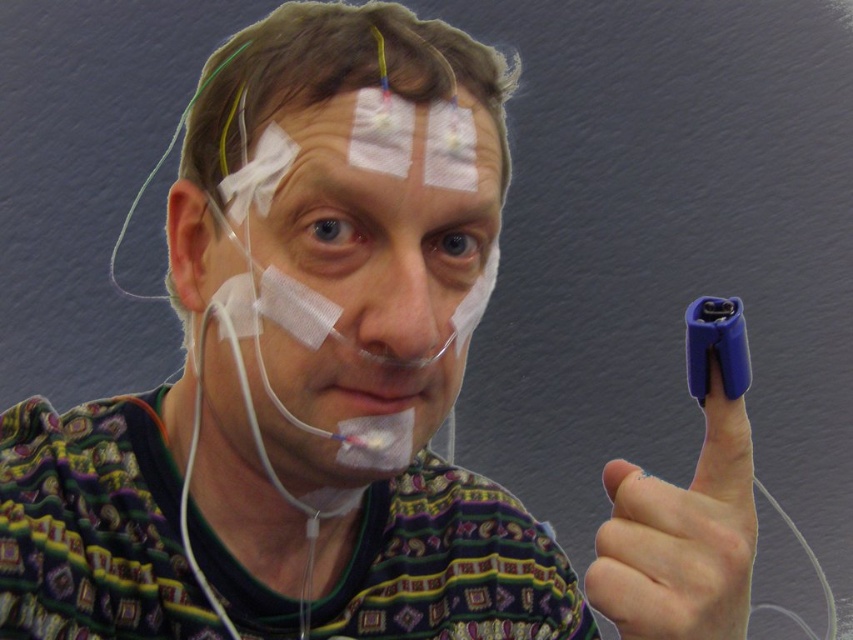
This screenshot has height=640, width=853. What do you see at coordinates (682, 538) in the screenshot?
I see `purple rubber finger at upper right` at bounding box center [682, 538].

Between purple rubber finger at upper right and matte white nose at center, which one has more height?

purple rubber finger at upper right

Does point (730, 429) come behind point (364, 344)?

No, it is in front of (364, 344).

You are a GUI agent. You are given a task and a screenshot of the screen. Output one action in this format:
    pyautogui.click(x=<x>, y=<y>)
    Task: Click on the purple rubber finger at upper right
    This screenshot has width=853, height=640.
    Given the screenshot: What is the action you would take?
    pyautogui.click(x=682, y=538)

Who is lower down, white matte bandage at center or matte white nose at center?

matte white nose at center is lower down.

Is white matte bandage at center to the left of matte white nose at center from the viewer's perspective?

Indeed, white matte bandage at center is positioned on the left side of matte white nose at center.

Is point (347, 445) more distant than point (358, 352)?

Yes, point (347, 445) is farther from viewer.

Identify the location of white matte bandage at center. (328, 310).

Is white matte bandage at center closer to camera compared to purple rubber finger at upper right?

No, it is not.

Between point (440, 337) and point (712, 424), which one is positioned in front?

Point (712, 424) is in front.

The height and width of the screenshot is (640, 853). I want to click on white matte bandage at center, so click(x=328, y=310).